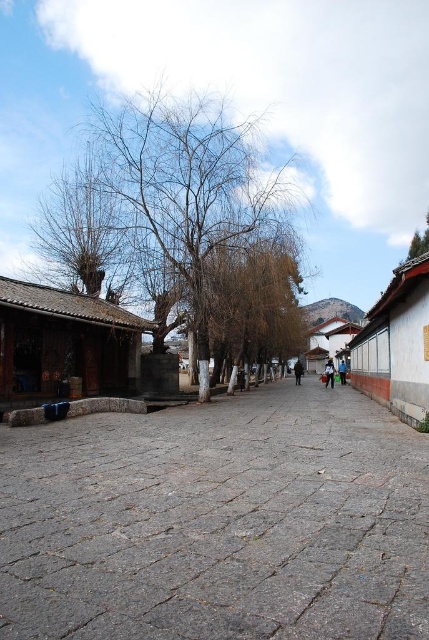
Question: Estimate the real-world distances between objects in this image. Which object is closer to the bare branches at left?

Choices:
 (A) black leather jacket at center
 (B) bare branches at upper left

Answer: (B)

Question: Does black leather jacket at center come behind blue denim jacket at center?

Choices:
 (A) yes
 (B) no

Answer: (B)

Question: Which object is farther from the camera taking this photo?

Choices:
 (A) blue denim jacket at center
 (B) bare branches at upper left
 (C) green fabric bag at center
 (D) bare branches at left

Answer: (A)

Question: Does green fabric bag at center have a lesser width compared to blue denim jacket at center?

Choices:
 (A) no
 (B) yes

Answer: (B)

Question: Does green fabric bag at center have a smaller size compared to blue denim jacket at center?

Choices:
 (A) no
 (B) yes

Answer: (B)

Question: Which point is closer to the camera taking this photo?

Choices:
 (A) (331, 384)
 (B) (299, 374)
 (C) (344, 378)

Answer: (A)